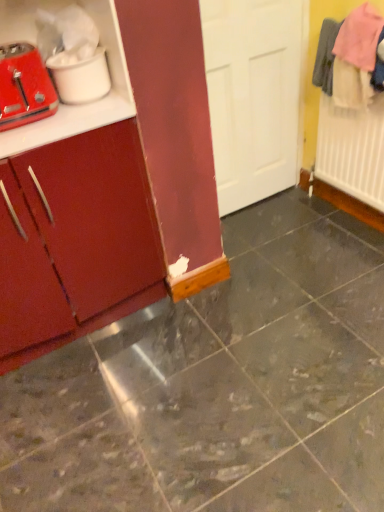
Question: Considering the relative sizes of matte wood cabinet at left and marble tile floor at center in the image provided, is matte wood cabinet at left wider than marble tile floor at center?

Choices:
 (A) yes
 (B) no

Answer: (B)

Question: Can you confirm if matte wood cabinet at left is bigger than marble tile floor at center?

Choices:
 (A) yes
 (B) no

Answer: (A)

Question: Is matte wood cabinet at left directly adjacent to marble tile floor at center?

Choices:
 (A) yes
 (B) no

Answer: (B)

Question: Is matte wood cabinet at left located outside marble tile floor at center?

Choices:
 (A) no
 (B) yes

Answer: (B)

Question: From a real-world perspective, is matte wood cabinet at left physically above marble tile floor at center?

Choices:
 (A) yes
 (B) no

Answer: (A)

Question: In terms of width, does marble tile floor at center look wider or thinner when compared to matte white toaster at left?

Choices:
 (A) wide
 (B) thin

Answer: (A)

Question: Based on their sizes in the image, would you say marble tile floor at center is bigger or smaller than matte white toaster at left?

Choices:
 (A) small
 (B) big

Answer: (B)

Question: Is marble tile floor at center in front of or behind matte white toaster at left in the image?

Choices:
 (A) behind
 (B) front

Answer: (B)

Question: From the image's perspective, is marble tile floor at center located above or below matte white toaster at left?

Choices:
 (A) above
 (B) below

Answer: (B)

Question: Looking at the image, does matte white toaster at left seem bigger or smaller compared to matte red toaster at left?

Choices:
 (A) small
 (B) big

Answer: (A)

Question: Is matte white toaster at left wider or thinner than matte red toaster at left?

Choices:
 (A) thin
 (B) wide

Answer: (B)

Question: Is matte white toaster at left taller or shorter than matte red toaster at left?

Choices:
 (A) tall
 (B) short

Answer: (B)

Question: Is matte white toaster at left spatially inside matte red toaster at left, or outside of it?

Choices:
 (A) outside
 (B) inside

Answer: (A)

Question: Considering the positions of matte white toaster at left and matte wood cabinet at left in the image, is matte white toaster at left bigger or smaller than matte wood cabinet at left?

Choices:
 (A) big
 (B) small

Answer: (B)

Question: Considering the relative positions of matte white toaster at left and matte wood cabinet at left in the image provided, is matte white toaster at left to the left or to the right of matte wood cabinet at left?

Choices:
 (A) left
 (B) right

Answer: (B)